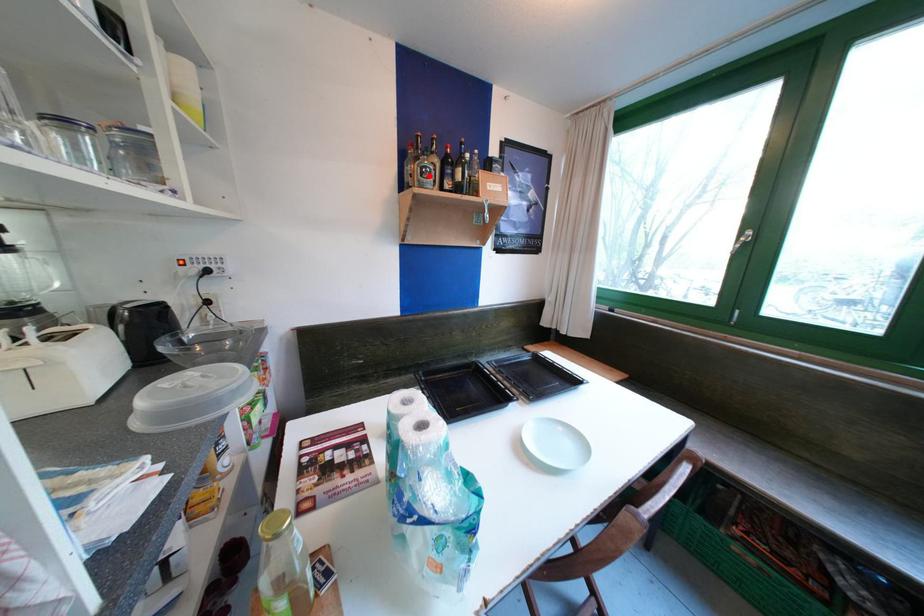
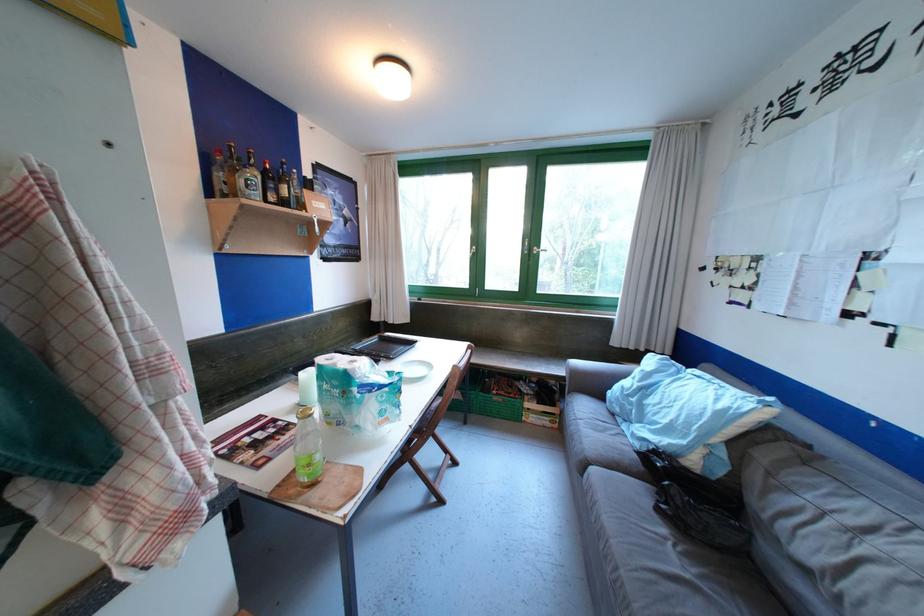
The point at the highlighted location is marked in the first image. Where is the corresponding point in the second image?

(254, 188)